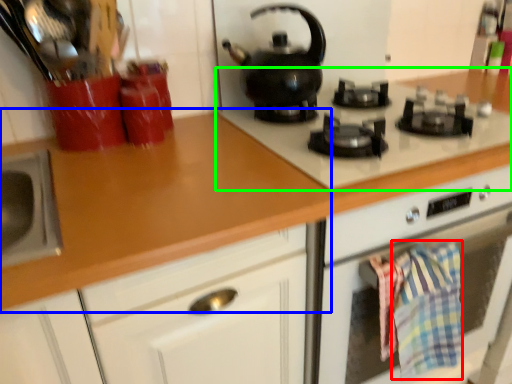
Question: Considering the real-world distances, which object is farthest from blanket (highlighted by a red box)? countertop (highlighted by a blue box) or gas stove (highlighted by a green box)?

Choices:
 (A) countertop
 (B) gas stove

Answer: (A)